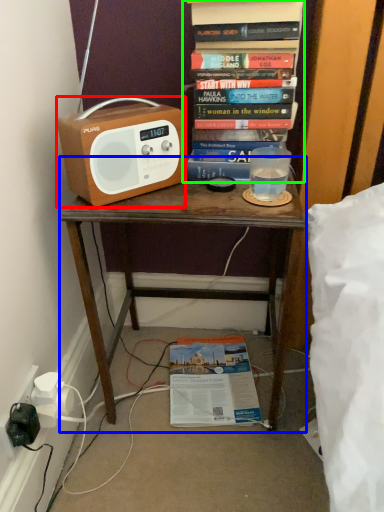
Question: Which is nearer to the cassette (highlighted by a red box)? desk (highlighted by a blue box) or book (highlighted by a green box).

Choices:
 (A) desk
 (B) book

Answer: (B)